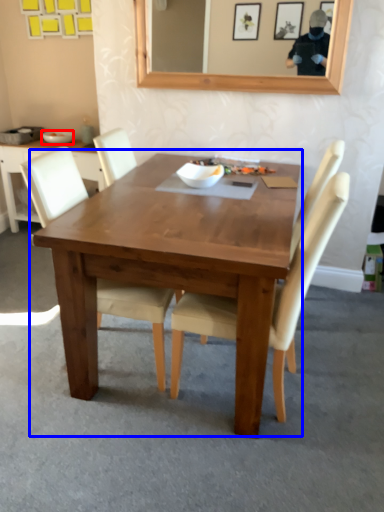
Question: Which of the following is the farthest to the observer, bowl (highlighted by a red box) or kitchen & dining room table (highlighted by a blue box)?

Choices:
 (A) bowl
 (B) kitchen & dining room table

Answer: (A)